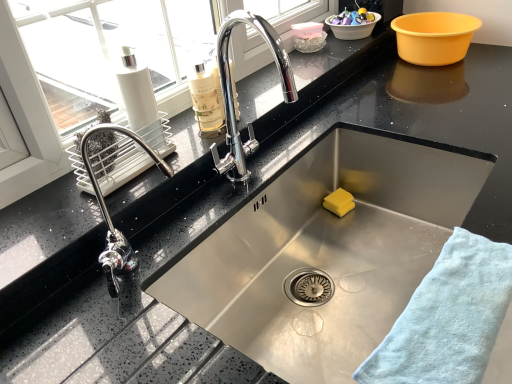
Question: Is yellow plastic basin at upper right, acting as the 3th basin starting from the left, taller than white matte bottle at upper left?

Choices:
 (A) yes
 (B) no

Answer: (B)

Question: From a real-world perspective, is yellow plastic basin at upper right, acting as the 3th basin starting from the left, below white matte bottle at upper left?

Choices:
 (A) no
 (B) yes

Answer: (B)

Question: Is yellow plastic basin at upper right, which is counted as the 1th basin, starting from the right, aimed at white matte bottle at upper left?

Choices:
 (A) yes
 (B) no

Answer: (B)

Question: Is yellow plastic basin at upper right, acting as the 3th basin starting from the left, smaller than white matte bottle at upper left?

Choices:
 (A) no
 (B) yes

Answer: (A)

Question: Can you confirm if yellow plastic basin at upper right, acting as the 3th basin starting from the left, is wider than white matte bottle at upper left?

Choices:
 (A) yes
 (B) no

Answer: (A)

Question: Is yellow plastic basin at upper right, acting as the 3th basin starting from the left, thinner than white matte bottle at upper left?

Choices:
 (A) yes
 (B) no

Answer: (B)

Question: From the image's perspective, is yellow sponge at sink bottom on yellow plastic basin at upper right, which is counted as the 1th basin, starting from the right?

Choices:
 (A) yes
 (B) no

Answer: (B)

Question: Can you confirm if yellow sponge at sink bottom is thinner than yellow plastic basin at upper right, acting as the 3th basin starting from the left?

Choices:
 (A) no
 (B) yes

Answer: (B)

Question: Considering the relative sizes of yellow sponge at sink bottom and yellow plastic basin at upper right, acting as the 3th basin starting from the left, in the image provided, is yellow sponge at sink bottom shorter than yellow plastic basin at upper right, acting as the 3th basin starting from the left,?

Choices:
 (A) yes
 (B) no

Answer: (A)

Question: Would you say yellow sponge at sink bottom is outside yellow plastic basin at upper right, acting as the 3th basin starting from the left?

Choices:
 (A) yes
 (B) no

Answer: (A)

Question: Does yellow sponge at sink bottom lie behind yellow plastic basin at upper right, acting as the 3th basin starting from the left?

Choices:
 (A) yes
 (B) no

Answer: (B)

Question: Is yellow sponge at sink bottom next to yellow plastic basin at upper right, acting as the 3th basin starting from the left?

Choices:
 (A) yes
 (B) no

Answer: (B)

Question: Is white plastic basin at upper right, which ranks as the second basin in right-to-left order, oriented towards yellow sponge at sink bottom?

Choices:
 (A) no
 (B) yes

Answer: (A)